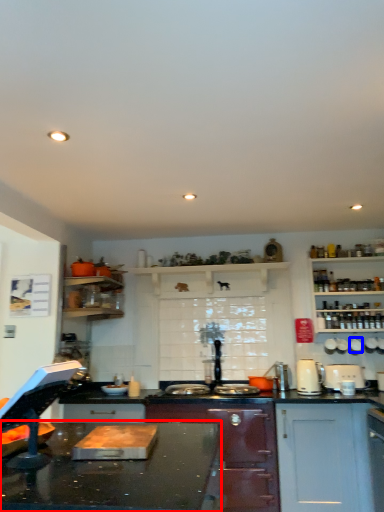
Question: Which object appears closest to the camera in this image, countertop (highlighted by a red box) or appliance (highlighted by a blue box)?

Choices:
 (A) countertop
 (B) appliance

Answer: (A)